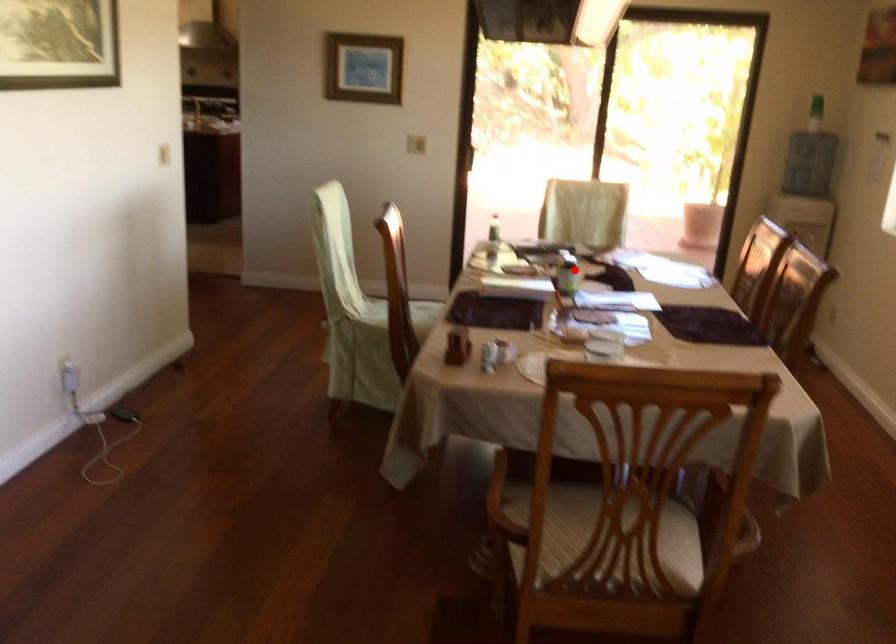
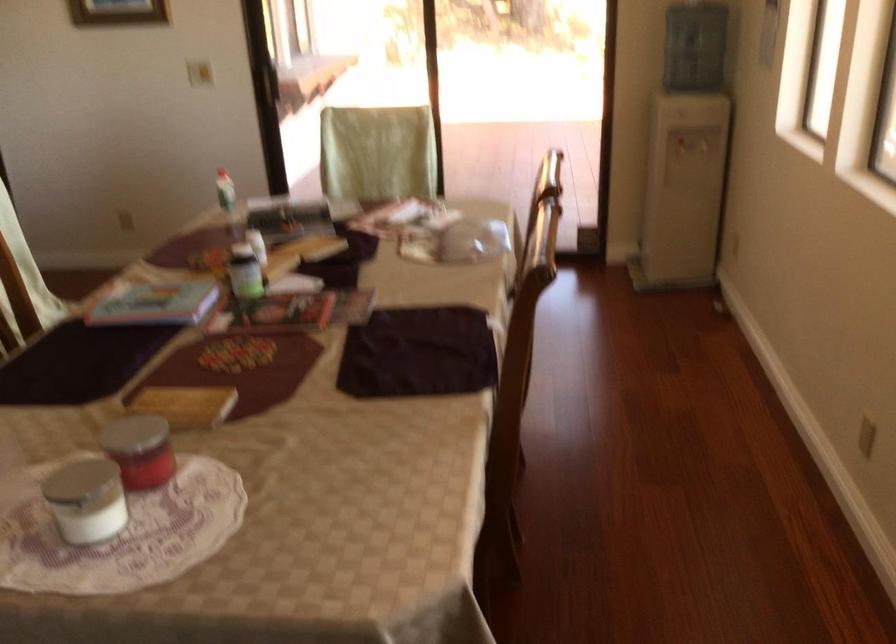
The point at the highlighted location is marked in the first image. Where is the corresponding point in the second image?

(245, 272)